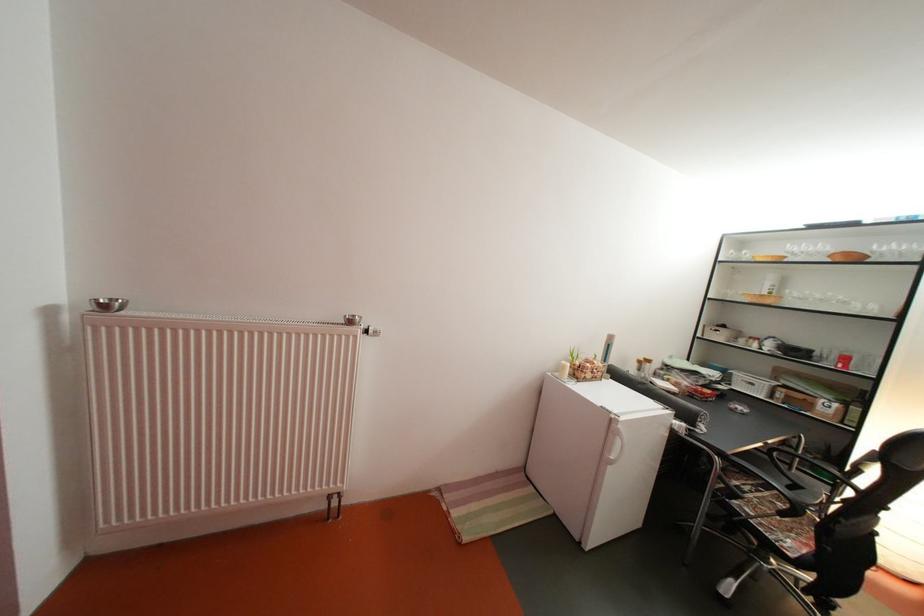
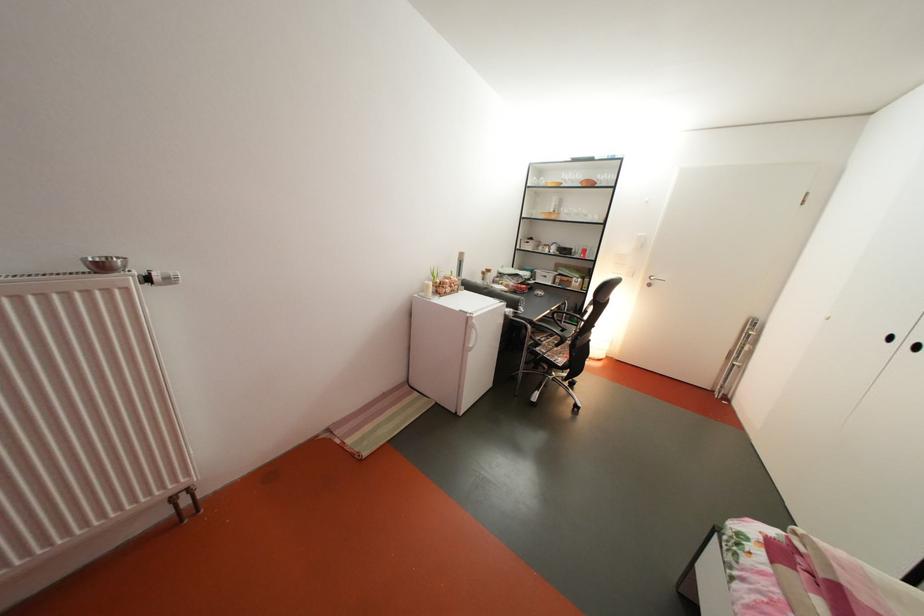
Find the pixel in the second image that matches pixel 748 488 in the first image.

(550, 344)